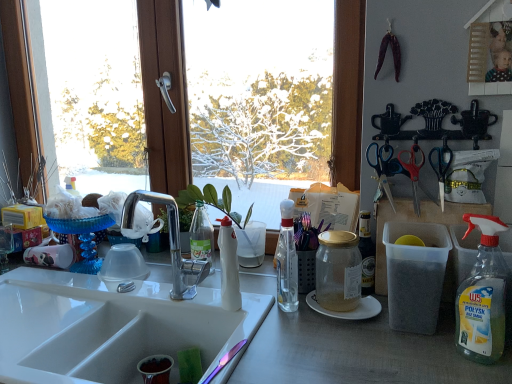
Identify the location of blank space to the left of white matte bottle at center, which appears as the first bottle when viewed from the left. (187, 301).